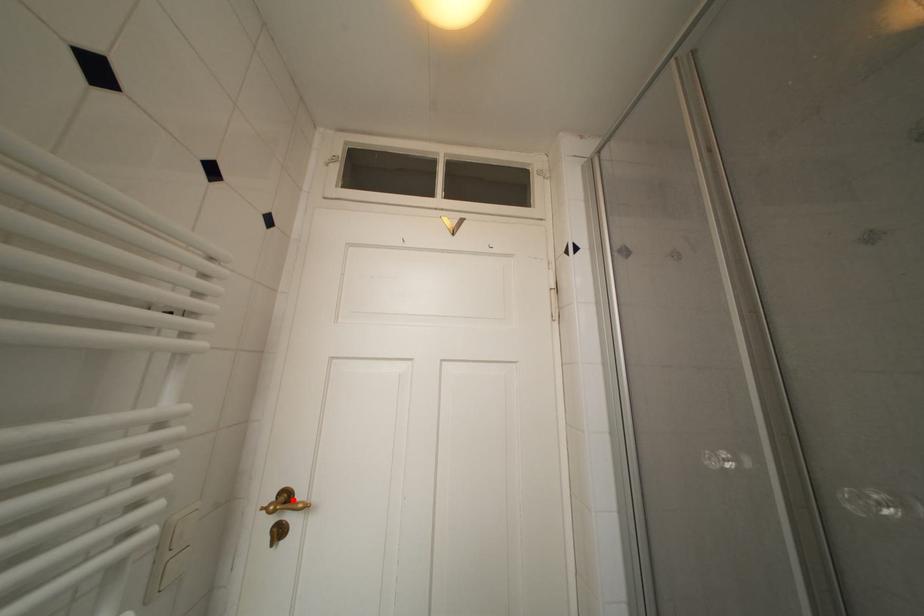
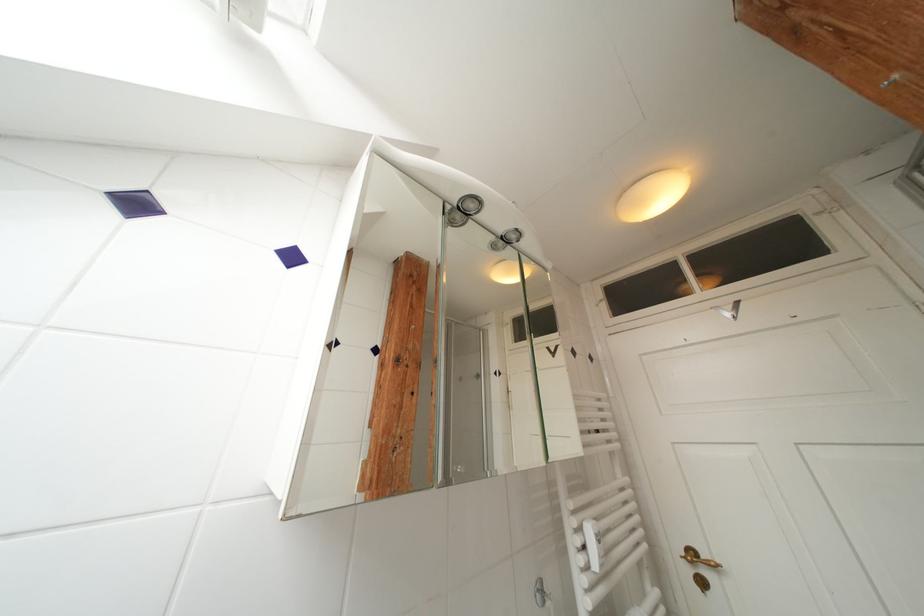
Locate, in the second image, the point that corresponds to the highlighted location in the first image.

(699, 557)